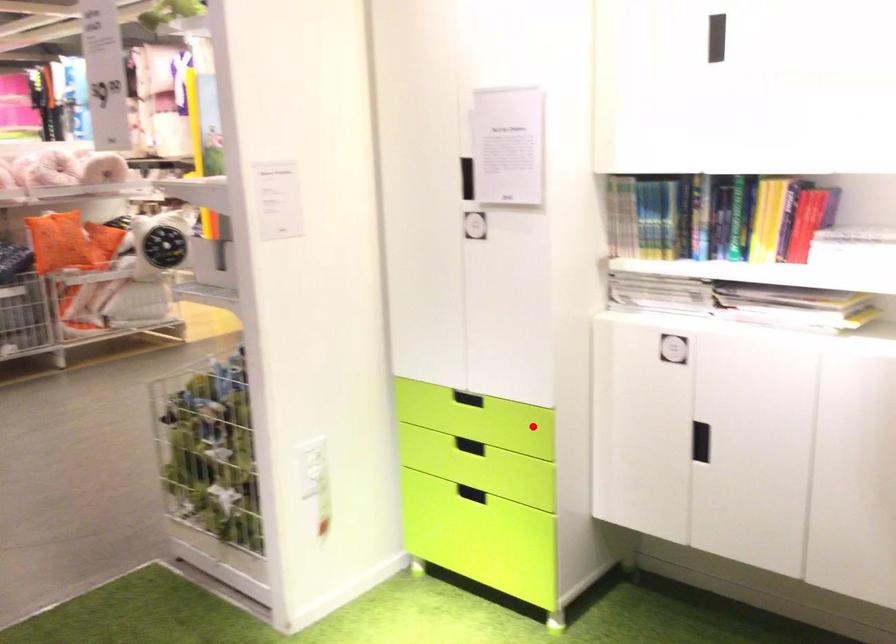
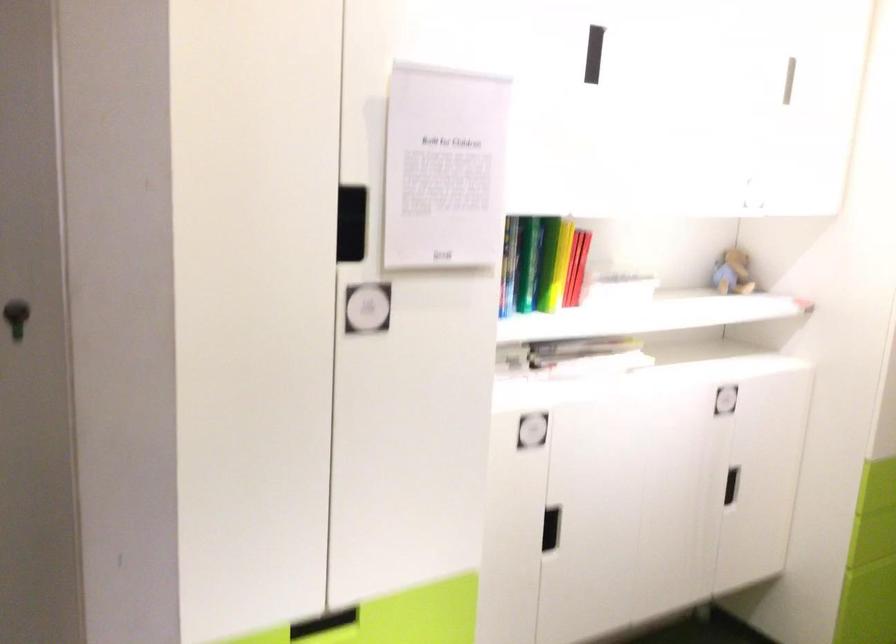
In the second image, find the point that corresponds to the highlighted location in the first image.

(323, 623)